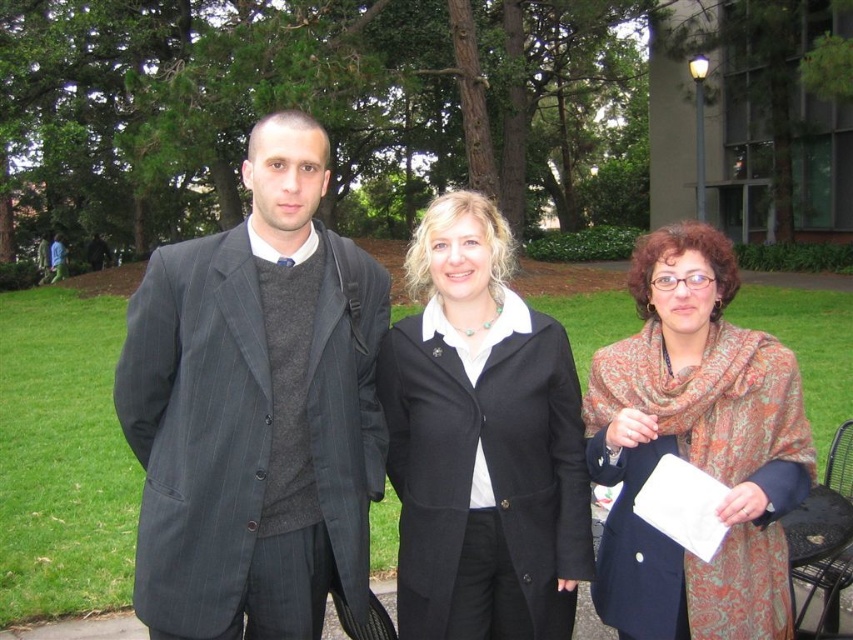
You are standing in a park and want to take a photo of the person at point (x=265, y=353). If your camera has a maximum focus range of 8 feet, will you be able to capture them clearly?

The distance between you and the person at point (x=265, y=353) is 8.34 feet, which exceeds the camera maximum focus range of 8 feet. Therefore, you won

You are a photographer standing at the camera position. You want to take a photo of both point (x=254, y=170) and point (x=581, y=440) in the scene. Which point should you focus on first to ensure both are in sharp focus?

You should focus on point (x=254, y=170) first because it is closer to the camera than point (x=581, y=440). This ensures the closer point is in focus, and due to depth of field, the farther point may also be acceptably sharp.